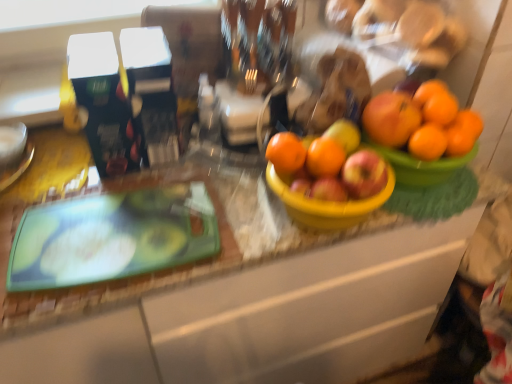
Question: Is red matte apple at center inside or outside of orange matte at center, which is counted as the 2th orange, starting from the left?

Choices:
 (A) inside
 (B) outside

Answer: (B)

Question: In the image, is red matte apple at center positioned in front of or behind orange matte at center, positioned as the third orange in right-to-left order?

Choices:
 (A) front
 (B) behind

Answer: (A)

Question: Which object is positioned closest to the orange matte at center, positioned as the third orange in right-to-left order?

Choices:
 (A) orange matte at upper right, which is counted as the second orange, starting from the right
 (B) red matte apple at center
 (C) orange matte at center, which appears as the fourth orange when viewed from the right
 (D) green glossy cutting board at left
 (E) orange matte at right, which is the 1th orange in right-to-left order

Answer: (C)

Question: Estimate the real-world distances between objects in this image. Which object is closer to the orange matte at center, which appears as the fourth orange when viewed from the right?

Choices:
 (A) orange matte at center, which is counted as the 2th orange, starting from the left
 (B) orange matte at right, which is the 1th orange in right-to-left order
 (C) orange matte at upper right, arranged as the third orange when viewed from the left
 (D) green glossy cutting board at left
 (E) red matte apple at center

Answer: (A)